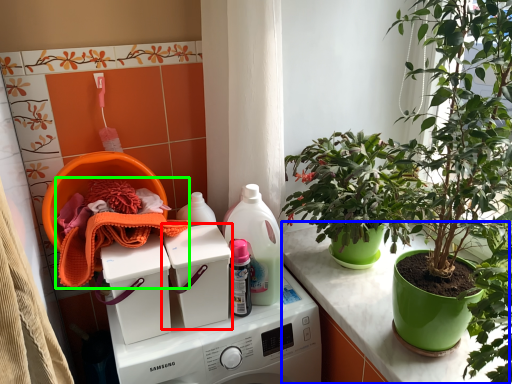
Question: Estimate the real-world distances between objects in this image. Which object is closer to washing machine (highlighted by a red box), counter (highlighted by a blue box) or material (highlighted by a green box)?

Choices:
 (A) counter
 (B) material

Answer: (B)